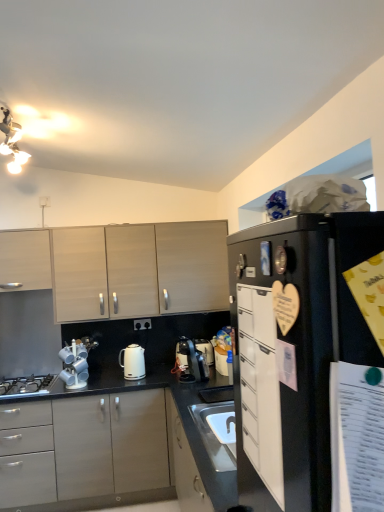
Identify the location of spots to the right of metallic silver cup rack at lower left. coord(100,386).